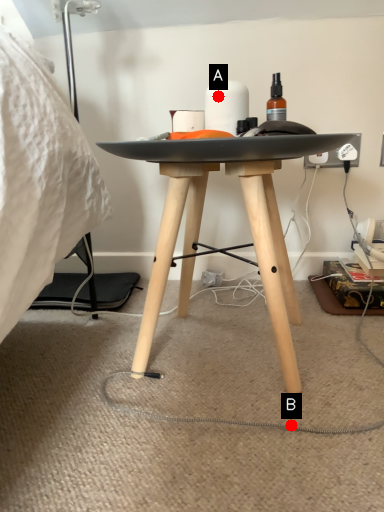
Question: Two points are circled on the image, labeled by A and B beside each circle. Among these points, which one is nearest to the camera?

Choices:
 (A) A is closer
 (B) B is closer

Answer: (B)